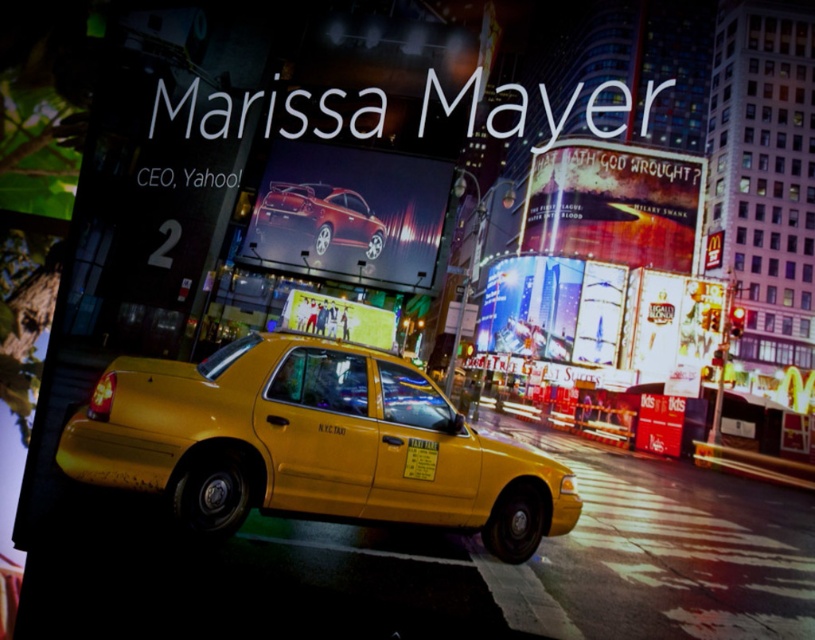
You are a pedestrian standing at the intersection and want to look at both the matte white billboard at upper right and the white glossy billboard at center. Which one should you turn your head to the right to view?

To view the matte white billboard at upper right, you should turn your head to the right since it is positioned to the right of the white glossy billboard at center.

You are standing in the middle of the scene and want to walk towards the two points labeled in the image. Which point, point (584, 257) or point (296, 196), will you reach first?

You will reach point (296, 196) first because it is closer to you than point (584, 257), which is further away.